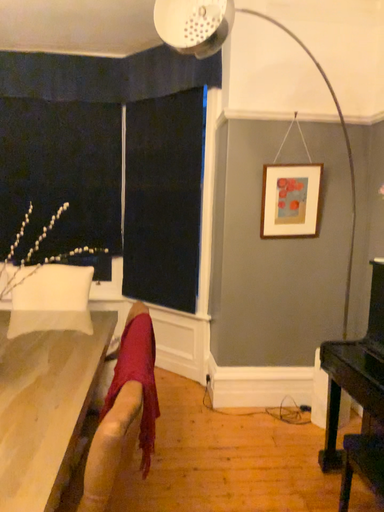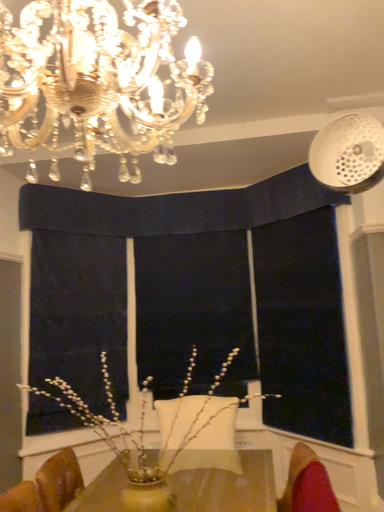
Question: Which way did the camera rotate in the video?

Choices:
 (A) rotated downward
 (B) rotated upward

Answer: (B)